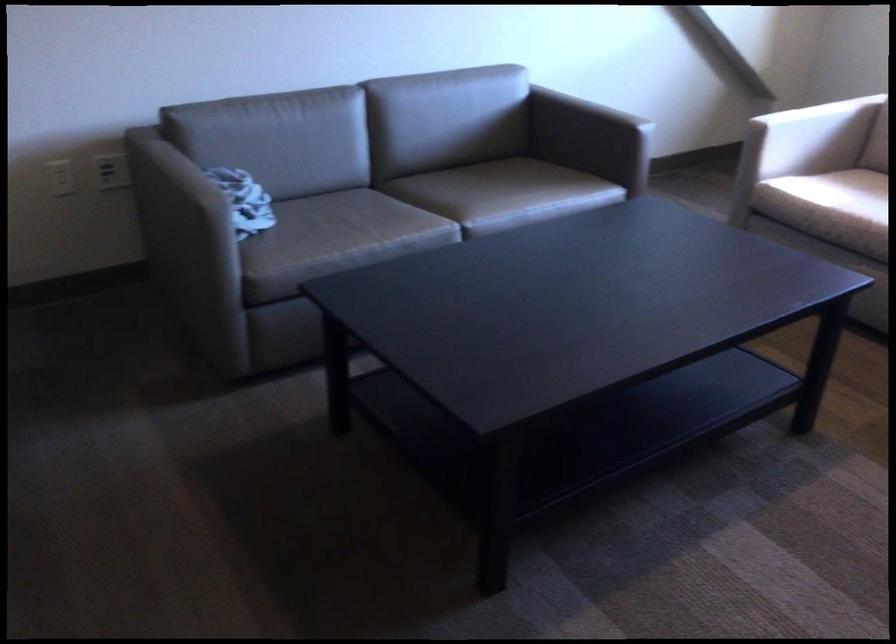
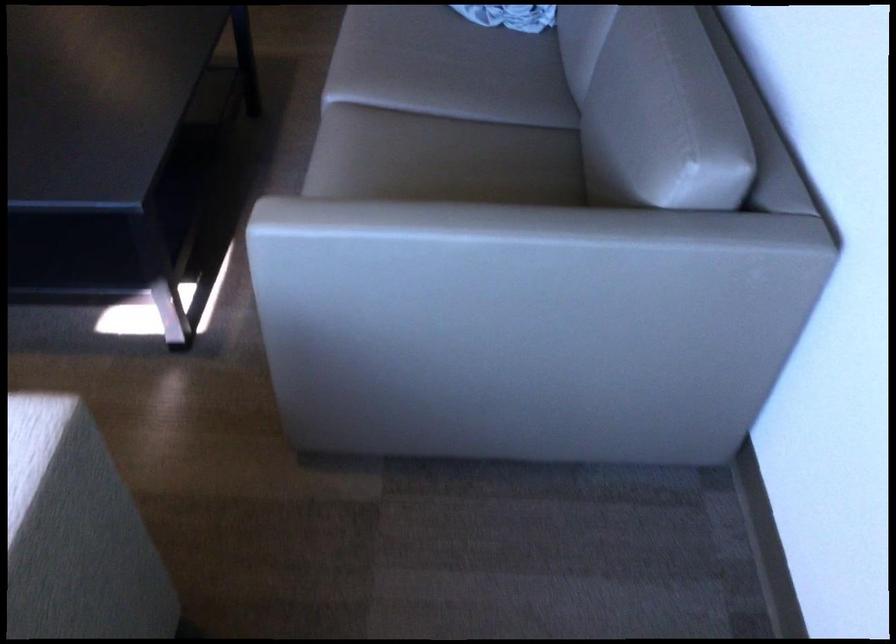
Find the pixel in the second image that matches point (348, 207) in the first image.

(463, 73)